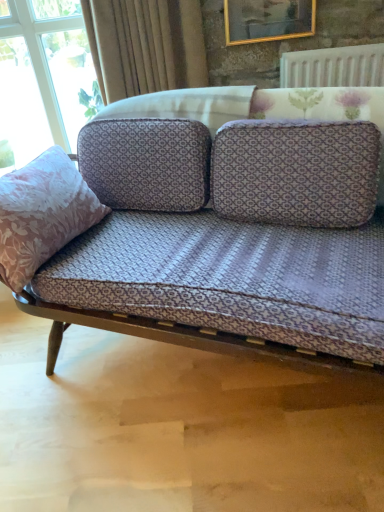
Question: Is gold-framed picture at upper center placed right next to velvet beige curtain at upper center?

Choices:
 (A) yes
 (B) no

Answer: (B)

Question: Could you tell me if gold-framed picture at upper center is facing velvet beige curtain at upper center?

Choices:
 (A) no
 (B) yes

Answer: (A)

Question: Can you confirm if gold-framed picture at upper center is positioned to the left of velvet beige curtain at upper center?

Choices:
 (A) yes
 (B) no

Answer: (B)

Question: From the image's perspective, does gold-framed picture at upper center appear lower than velvet beige curtain at upper center?

Choices:
 (A) yes
 (B) no

Answer: (B)

Question: Can you confirm if gold-framed picture at upper center is taller than velvet beige curtain at upper center?

Choices:
 (A) no
 (B) yes

Answer: (A)

Question: Is the depth of gold-framed picture at upper center less than that of velvet beige curtain at upper center?

Choices:
 (A) no
 (B) yes

Answer: (A)

Question: Considering the relative sizes of white textured radiator at upper right and pink floral fabric pillow at left in the image provided, is white textured radiator at upper right shorter than pink floral fabric pillow at left?

Choices:
 (A) no
 (B) yes

Answer: (B)

Question: Does white textured radiator at upper right have a greater width compared to pink floral fabric pillow at left?

Choices:
 (A) yes
 (B) no

Answer: (B)

Question: Is white textured radiator at upper right located outside pink floral fabric pillow at left?

Choices:
 (A) no
 (B) yes

Answer: (B)

Question: From the image's perspective, is white textured radiator at upper right above pink floral fabric pillow at left?

Choices:
 (A) no
 (B) yes

Answer: (B)

Question: Can you confirm if white textured radiator at upper right is bigger than pink floral fabric pillow at left?

Choices:
 (A) no
 (B) yes

Answer: (A)

Question: From a real-world perspective, is white textured radiator at upper right under pink floral fabric pillow at left?

Choices:
 (A) yes
 (B) no

Answer: (B)

Question: Is gold-framed picture at upper center positioned with its back to pink floral fabric pillow at left?

Choices:
 (A) yes
 (B) no

Answer: (B)